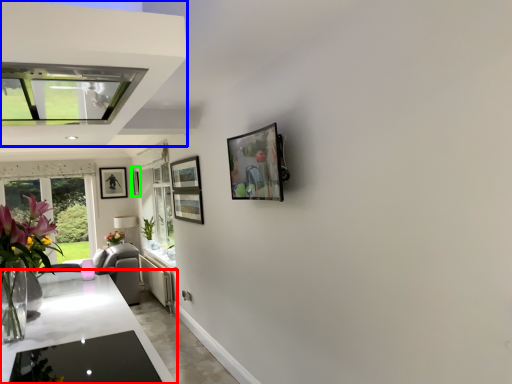
Question: Which is nearer to the countertop (highlighted by a red box)? exhaust hood (highlighted by a blue box) or picture frame (highlighted by a green box).

Choices:
 (A) exhaust hood
 (B) picture frame

Answer: (A)